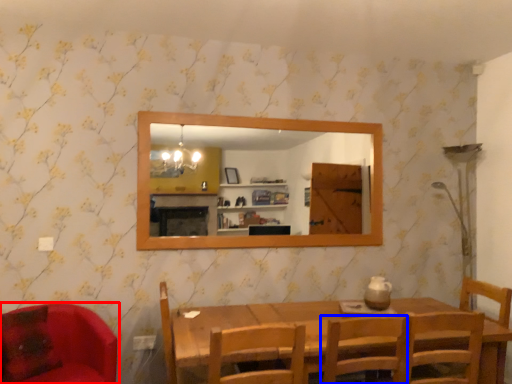
Question: Which object is further to the camera taking this photo, chair (highlighted by a red box) or chair (highlighted by a blue box)?

Choices:
 (A) chair
 (B) chair

Answer: (A)